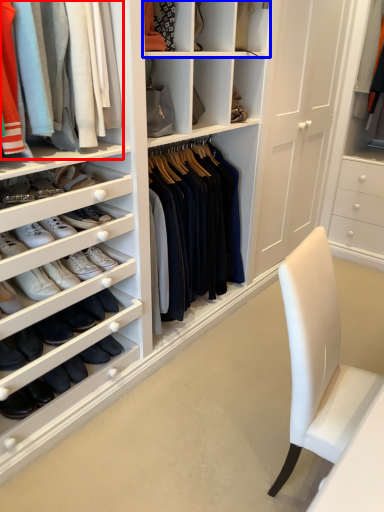
Question: Among these objects, which one is farthest to the camera, clothing (highlighted by a red box) or shelf (highlighted by a blue box)?

Choices:
 (A) clothing
 (B) shelf

Answer: (B)